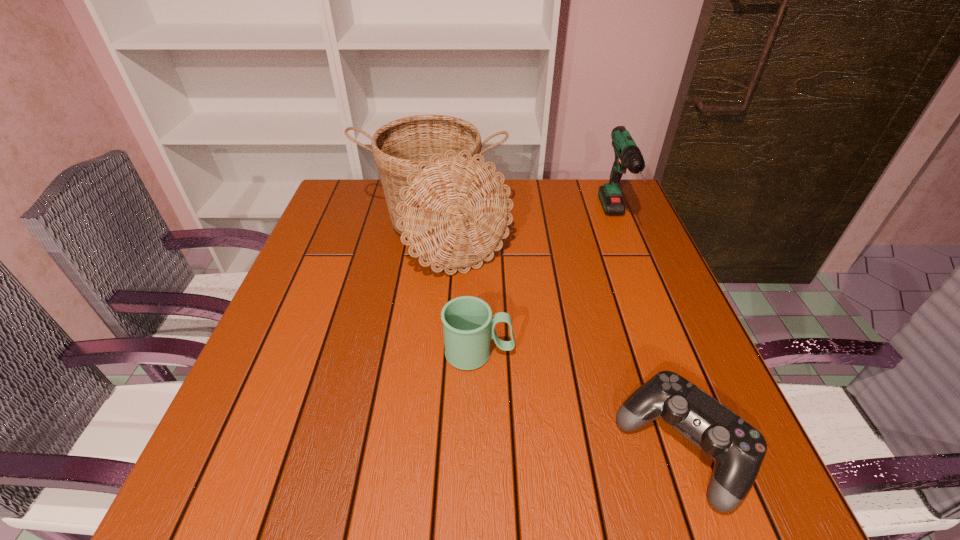
In order to click on basket in this screenshot , I will do `click(452, 208)`.

This screenshot has width=960, height=540. Find the location of `the second tallest object`. the second tallest object is located at coordinates (628, 156).

The height and width of the screenshot is (540, 960). Find the location of `the second nearest object`. the second nearest object is located at coordinates (468, 326).

Find the location of a particular element. The image size is (960, 540). mug is located at coordinates (468, 326).

Where is `the shortest object`? The image size is (960, 540). the shortest object is located at coordinates (738, 449).

The height and width of the screenshot is (540, 960). I want to click on control, so click(x=738, y=449).

Locate an element on the screen. This screenshot has height=540, width=960. free space located on the back of the basket is located at coordinates (441, 186).

Where is `vacant space situated on the handle side of the second tallest object`? vacant space situated on the handle side of the second tallest object is located at coordinates (633, 262).

Find the location of `vacant space situated on the side of the mug with the handle`. vacant space situated on the side of the mug with the handle is located at coordinates (665, 353).

Locate an element on the screen. This screenshot has height=540, width=960. free space located on the back of the control is located at coordinates (634, 309).